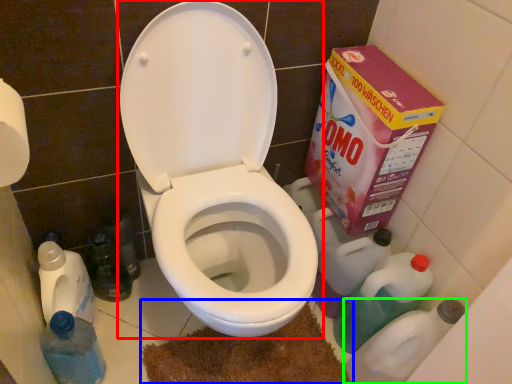
Question: Considering the real-world distances, which object is farthest from toilet (highlighted by a red box)? bath mat (highlighted by a blue box) or cleaning product (highlighted by a green box)?

Choices:
 (A) bath mat
 (B) cleaning product

Answer: (B)